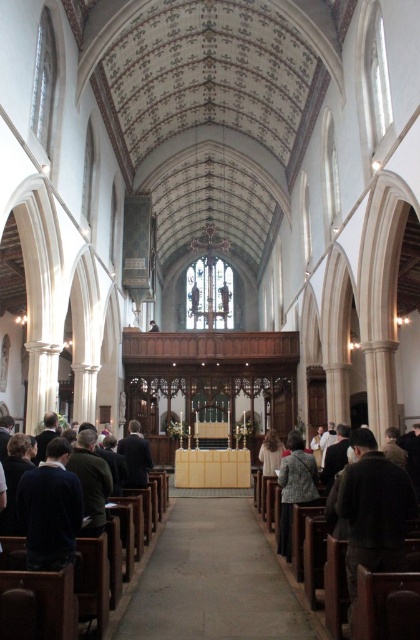
Question: Is dark brown leather jacket at lower right closer to camera compared to patterned fabric coat at lower center?

Choices:
 (A) yes
 (B) no

Answer: (A)

Question: From the image, what is the correct spatial relationship of dark brown leather jacket at lower right in relation to patterned fabric coat at lower center?

Choices:
 (A) above
 (B) below

Answer: (A)

Question: Which point is closer to the camera?

Choices:
 (A) dark brown leather jacket at lower right
 (B) patterned fabric coat at lower center

Answer: (A)

Question: Does dark brown leather jacket at lower right have a lesser width compared to patterned fabric coat at lower center?

Choices:
 (A) no
 (B) yes

Answer: (A)

Question: Which object appears farthest from the camera in this image?

Choices:
 (A) patterned fabric coat at lower center
 (B) dark brown leather jacket at lower right

Answer: (A)